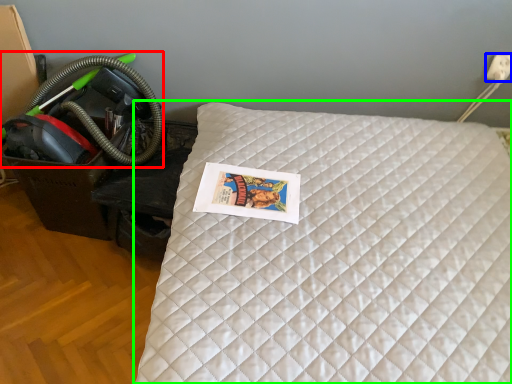
Question: Which object is positioned closest to garden hose (highlighted by a red box)? Select from electric outlet (highlighted by a blue box) and bed (highlighted by a green box).

Choices:
 (A) electric outlet
 (B) bed

Answer: (B)